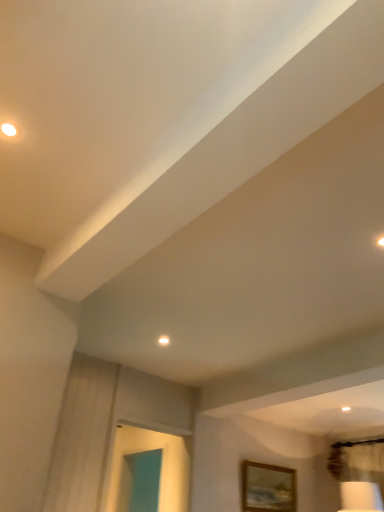
This screenshot has width=384, height=512. Describe the element at coordinates (268, 488) in the screenshot. I see `wooden picture frame at lower right` at that location.

Measure the distance between point (x=262, y=497) and camera.

Point (x=262, y=497) is 15.88 feet away from camera.

You are a GUI agent. You are given a task and a screenshot of the screen. Output one action in this format:
    pyautogui.click(x=<x>, y=<y>)
    Task: Click on the wooden picture frame at lower right
    
    Given the screenshot: What is the action you would take?
    pyautogui.click(x=268, y=488)

Image resolution: width=384 pixels, height=512 pixels. Identify the location of white glossy droplight at upper center. (163, 340).

This screenshot has height=512, width=384. Describe the element at coordinates (163, 340) in the screenshot. I see `white glossy droplight at upper center` at that location.

At what (x,y) coordinates should I click in order to perform the action: click on wooden picture frame at lower right. Please return your answer as a coordinate pair (x, y). Image resolution: width=384 pixels, height=512 pixels. Looking at the image, I should click on (268, 488).

Does white glossy droplight at upper center appear on the left side of wooden picture frame at lower right?

Yes.

Considering their positions, is white glossy droplight at upper center located in front of or behind wooden picture frame at lower right?

In the image, white glossy droplight at upper center appears in front of wooden picture frame at lower right.

Is point (167, 337) behind point (280, 498)?

No, it is in front of (280, 498).

Consider the image. From the image's perspective, which one is positioned lower, white glossy droplight at upper center or wooden picture frame at lower right?

wooden picture frame at lower right.

In the scene shown: From a real-world perspective, is white glossy droplight at upper center on wooden picture frame at lower right?

Indeed, from a real-world perspective, white glossy droplight at upper center stands above wooden picture frame at lower right.

Is white glossy droplight at upper center wider or thinner than wooden picture frame at lower right?

Clearly, white glossy droplight at upper center has less width compared to wooden picture frame at lower right.

Who is shorter, white glossy droplight at upper center or wooden picture frame at lower right?

white glossy droplight at upper center is shorter.

Between white glossy droplight at upper center and wooden picture frame at lower right, which one has smaller size?

white glossy droplight at upper center is smaller.

Choose the correct answer: Is white glossy droplight at upper center inside wooden picture frame at lower right or outside it?

white glossy droplight at upper center is not enclosed by wooden picture frame at lower right.

Is white glossy droplight at upper center touching wooden picture frame at lower right?

white glossy droplight at upper center is not next to wooden picture frame at lower right, and they're not touching.

From the picture: Is white glossy droplight at upper center looking in the opposite direction of wooden picture frame at lower right?

white glossy droplight at upper center does not have its back to wooden picture frame at lower right.

In the image, there is a white glossy droplight at upper center. Where is `picture frame below it (from the image's perspective)`? The height and width of the screenshot is (512, 384). picture frame below it (from the image's perspective) is located at coordinates (268, 488).

Which object is positioned more to the left, wooden picture frame at lower right or white glossy droplight at upper center?

From the viewer's perspective, white glossy droplight at upper center appears more on the left side.

Considering their positions, is wooden picture frame at lower right located in front of or behind white glossy droplight at upper center?

Visually, wooden picture frame at lower right is located behind white glossy droplight at upper center.

Does point (272, 489) lie behind point (168, 339)?

Yes, point (272, 489) is farther from viewer.

From the image's perspective, who appears lower, wooden picture frame at lower right or white glossy droplight at upper center?

wooden picture frame at lower right is shown below in the image.

From a real-world perspective, which object rests below the other?

wooden picture frame at lower right.

Considering the sizes of objects wooden picture frame at lower right and white glossy droplight at upper center in the image provided, who is thinner, wooden picture frame at lower right or white glossy droplight at upper center?

Thinner between the two is white glossy droplight at upper center.

Is wooden picture frame at lower right shorter than white glossy droplight at upper center?

No.

Which of these two, wooden picture frame at lower right or white glossy droplight at upper center, is smaller?

white glossy droplight at upper center.

Is wooden picture frame at lower right not inside white glossy droplight at upper center?

Yes.

Is wooden picture frame at lower right with white glossy droplight at upper center?

No, wooden picture frame at lower right is not in contact with white glossy droplight at upper center.

Is wooden picture frame at lower right looking in the opposite direction of white glossy droplight at upper center?

No, wooden picture frame at lower right is not facing the opposite direction of white glossy droplight at upper center.

Can you tell me how much wooden picture frame at lower right and white glossy droplight at upper center differ in facing direction?

The angle between the facing direction of wooden picture frame at lower right and the facing direction of white glossy droplight at upper center is 0.000707 degrees.

How distant is wooden picture frame at lower right from white glossy droplight at upper center?

9.17 feet.

This screenshot has width=384, height=512. I want to click on droplight lying in front of the wooden picture frame at lower right, so click(163, 340).

Find the location of a particular element. Image resolution: width=384 pixels, height=512 pixels. picture frame lying on the right of white glossy droplight at upper center is located at coordinates (268, 488).

You are a GUI agent. You are given a task and a screenshot of the screen. Output one action in this format:
    pyautogui.click(x=<x>, y=<y>)
    Task: Click on the droplight in front of the wooden picture frame at lower right
    The image size is (384, 512).
    Given the screenshot: What is the action you would take?
    pyautogui.click(x=163, y=340)